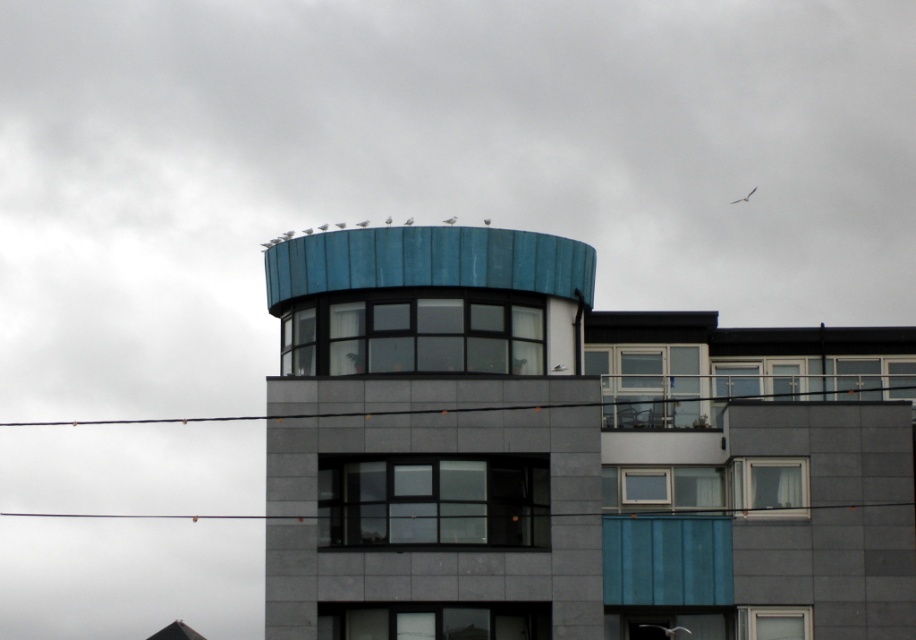
Question: Which point is farther to the camera?

Choices:
 (A) pyautogui.click(x=569, y=605)
 (B) pyautogui.click(x=846, y=481)

Answer: (B)

Question: Which point is farther from the camera taking this photo?

Choices:
 (A) (853, 426)
 (B) (557, 570)

Answer: (A)

Question: Observing the image, what is the correct spatial positioning of blue textured tower at upper center in reference to white plastic window at lower right?

Choices:
 (A) left
 (B) right

Answer: (A)

Question: Can you confirm if blue textured tower at upper center is positioned below white plastic window at lower right?

Choices:
 (A) yes
 (B) no

Answer: (B)

Question: Can you confirm if blue textured tower at upper center is positioned below white plastic window at lower right?

Choices:
 (A) no
 (B) yes

Answer: (A)

Question: Which of the following is the farthest from the observer?

Choices:
 (A) (371, 456)
 (B) (827, 616)

Answer: (A)